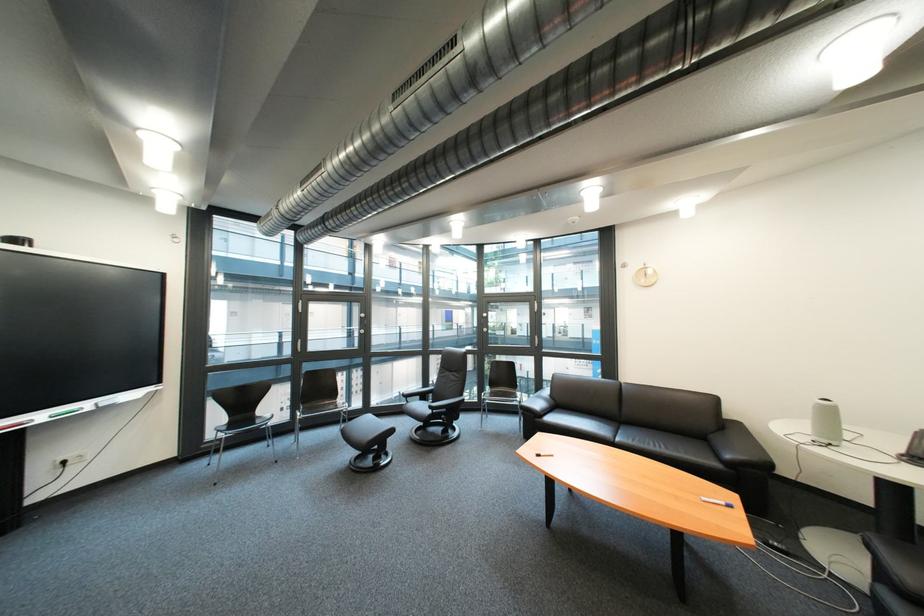
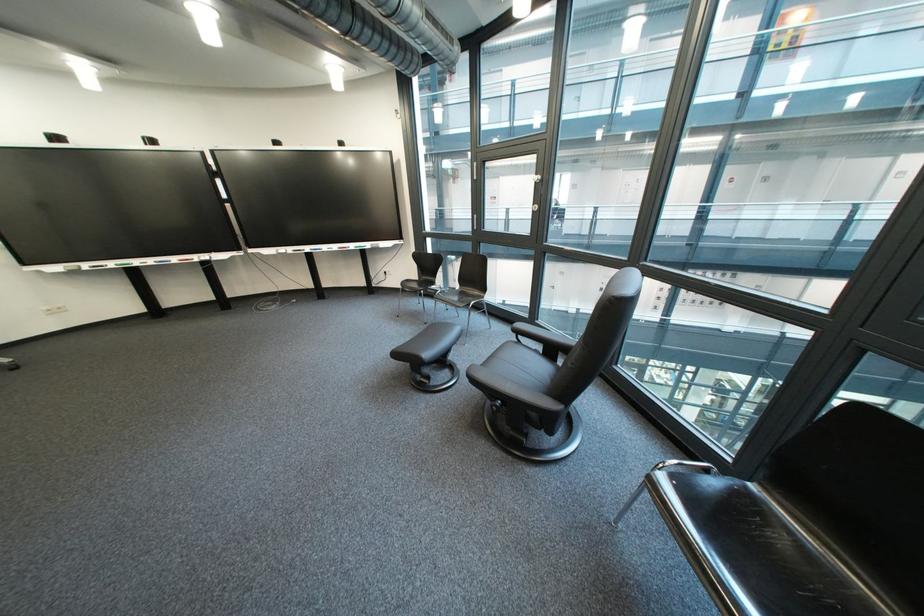
Where in the second image is the point corresponding to point (290, 464) from the first image?

(439, 325)